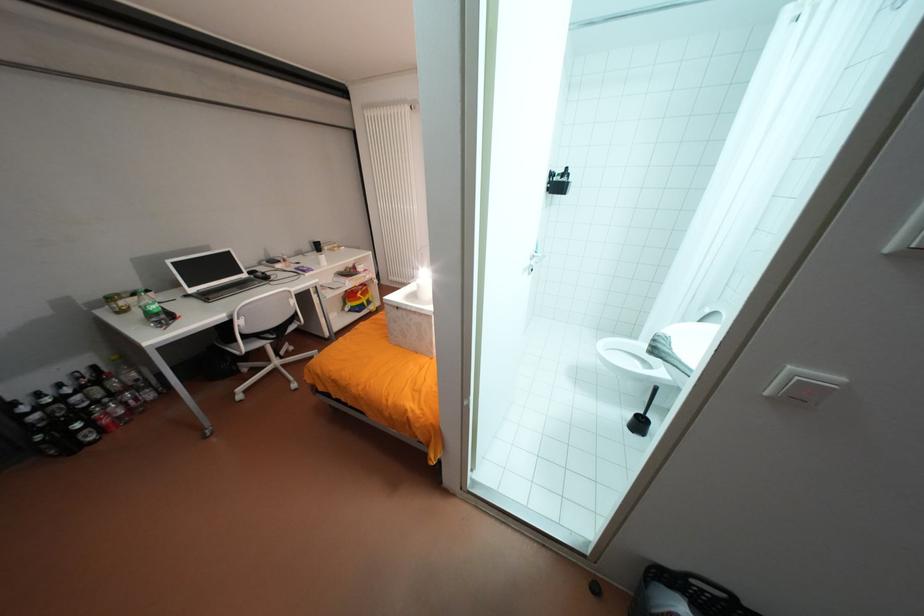
This screenshot has height=616, width=924. What do you see at coordinates (533, 261) in the screenshot? I see `a shower door handle` at bounding box center [533, 261].